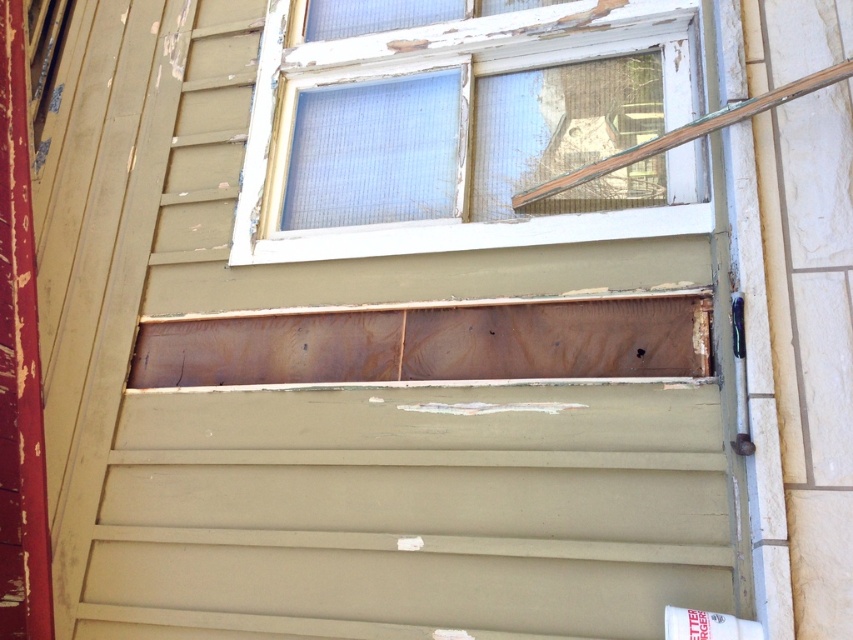
Question: Can you confirm if wooden panel at center is bigger than wooden at upper right?

Choices:
 (A) no
 (B) yes

Answer: (B)

Question: Can you confirm if white wood window frame at upper center is positioned to the left of wooden panel at center?

Choices:
 (A) no
 (B) yes

Answer: (A)

Question: Which of these objects is positioned farthest from the wooden panel at center?

Choices:
 (A) wooden at upper right
 (B) white wood window frame at upper center

Answer: (A)

Question: Estimate the real-world distances between objects in this image. Which object is closer to the wooden panel at center?

Choices:
 (A) wooden at upper right
 (B) white wood window frame at upper center

Answer: (B)

Question: Which point is closer to the camera taking this photo?

Choices:
 (A) (584, 106)
 (B) (602, 365)

Answer: (B)

Question: Considering the relative positions of white wood window frame at upper center and wooden panel at center in the image provided, where is white wood window frame at upper center located with respect to wooden panel at center?

Choices:
 (A) above
 (B) below

Answer: (A)